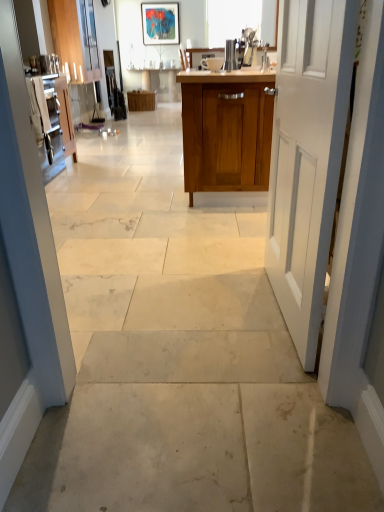
Question: Considering the relative sizes of satin silver kettle at center and matte acrylic painting at upper center in the image provided, is satin silver kettle at center bigger than matte acrylic painting at upper center?

Choices:
 (A) no
 (B) yes

Answer: (A)

Question: Can you confirm if satin silver kettle at center is positioned to the left of matte acrylic painting at upper center?

Choices:
 (A) yes
 (B) no

Answer: (B)

Question: Considering the relative sizes of satin silver kettle at center and matte acrylic painting at upper center in the image provided, is satin silver kettle at center smaller than matte acrylic painting at upper center?

Choices:
 (A) no
 (B) yes

Answer: (B)

Question: Is matte acrylic painting at upper center at the back of satin silver kettle at center?

Choices:
 (A) yes
 (B) no

Answer: (B)

Question: Would you say satin silver kettle at center contains matte acrylic painting at upper center?

Choices:
 (A) yes
 (B) no

Answer: (B)

Question: Is satin silver kettle at center at the right side of matte acrylic painting at upper center?

Choices:
 (A) yes
 (B) no

Answer: (A)

Question: From a real-world perspective, is wooden cabinet at center, which is the first cabinetry from right to left, on top of matte acrylic painting at upper center?

Choices:
 (A) no
 (B) yes

Answer: (A)

Question: Does wooden cabinet at center, arranged as the first cabinetry when viewed from the front, contain matte acrylic painting at upper center?

Choices:
 (A) no
 (B) yes

Answer: (A)

Question: Is wooden cabinet at center, which is the 2th cabinetry in top-to-bottom order, oriented away from matte acrylic painting at upper center?

Choices:
 (A) no
 (B) yes

Answer: (B)

Question: Is wooden cabinet at center, the 1th cabinetry when ordered from bottom to top, to the left of matte acrylic painting at upper center from the viewer's perspective?

Choices:
 (A) no
 (B) yes

Answer: (A)

Question: Is wooden cabinet at center, which is the second cabinetry in left-to-right order, oriented towards matte acrylic painting at upper center?

Choices:
 (A) yes
 (B) no

Answer: (B)

Question: Is wooden cabinet at center, the 1th cabinetry when ordered from bottom to top, outside of matte acrylic painting at upper center?

Choices:
 (A) yes
 (B) no

Answer: (A)

Question: Considering the relative positions of wooden cabinet at center, which is the 2th cabinetry in back-to-front order, and satin silver kettle at center in the image provided, is wooden cabinet at center, which is the 2th cabinetry in back-to-front order, in front of satin silver kettle at center?

Choices:
 (A) no
 (B) yes

Answer: (B)